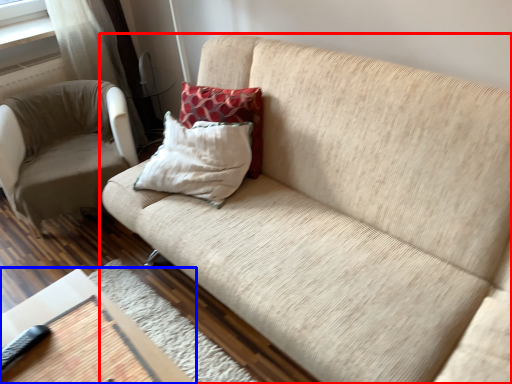
Question: Which object is closer to the camera taking this photo, studio couch (highlighted by a red box) or table (highlighted by a blue box)?

Choices:
 (A) studio couch
 (B) table

Answer: (A)